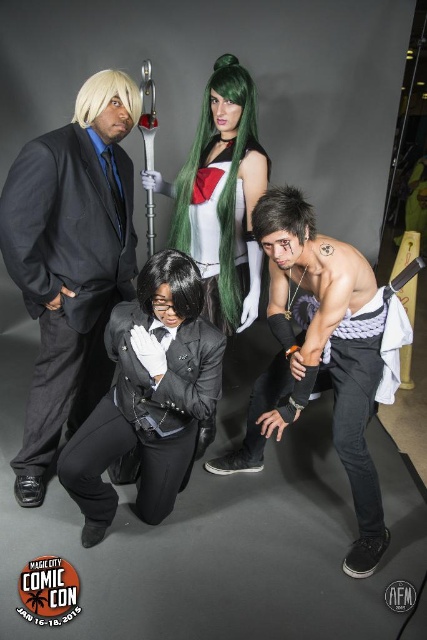
Question: Does matte black suit at left appear under black satin suit at center?

Choices:
 (A) yes
 (B) no

Answer: (B)

Question: Which point is farther from the camera taking this photo?

Choices:
 (A) (335, 371)
 (B) (204, 369)

Answer: (A)

Question: In this image, where is matte black suit at left located relative to shiny black shirt at lower right?

Choices:
 (A) right
 (B) left

Answer: (B)

Question: Which point appears farthest from the camera in this image?

Choices:
 (A) (116, 97)
 (B) (187, 200)

Answer: (B)

Question: Which point is closer to the camera?

Choices:
 (A) shiny black shirt at lower right
 (B) black silky hair at center
 (C) matte black suit at left
 (D) shiny green wig at center

Answer: (B)

Question: Is green satin dress at center smaller than blonde synthetic wig at upper left?

Choices:
 (A) yes
 (B) no

Answer: (B)